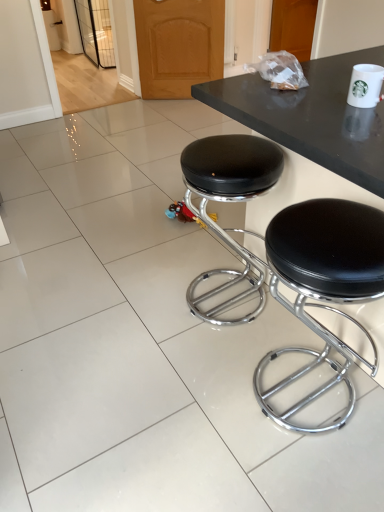
Where is `empty space that is ontop of black leather stool at center, which is the first stool from right to left (from a real-world perspective)`? This screenshot has width=384, height=512. empty space that is ontop of black leather stool at center, which is the first stool from right to left (from a real-world perspective) is located at coordinates (324, 237).